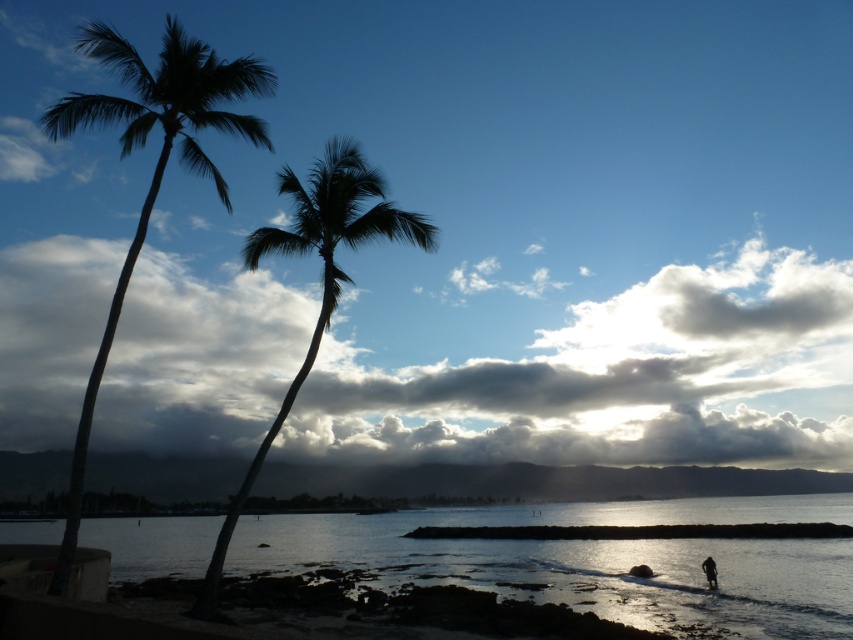
You are a photographer trying to capture the cloudy sky at upper center and the dark skin textured person at lower right in a single frame. Based on their sizes in the image, which one will occupy more of the photo?

The cloudy sky at upper center is larger in size than the dark skin textured person at lower right, so it will occupy more of the photo.